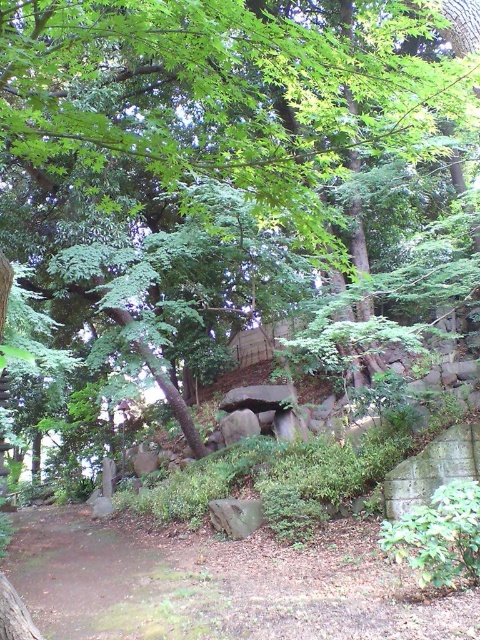
Question: Can you confirm if brown dirt path at lower center is positioned above rough gray rock at center?

Choices:
 (A) no
 (B) yes

Answer: (A)

Question: Which of the following is the closest to the observer?

Choices:
 (A) brown dirt path at lower center
 (B) rough gray rock at center

Answer: (A)

Question: Does brown dirt path at lower center appear on the right side of rough gray rock at center?

Choices:
 (A) no
 (B) yes

Answer: (B)

Question: Which point appears closest to the camera in this image?

Choices:
 (A) [242, 435]
 (B) [243, 611]

Answer: (B)

Question: Among these objects, which one is farthest from the camera?

Choices:
 (A) rough gray rock at center
 (B) brown dirt path at lower center

Answer: (A)

Question: Is brown dirt path at lower center smaller than rough gray rock at center?

Choices:
 (A) no
 (B) yes

Answer: (A)